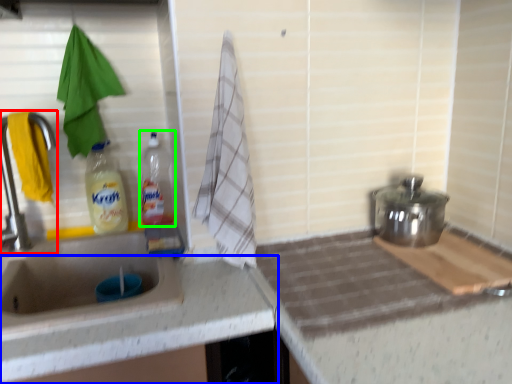
Question: Which is nearer to the tap (highlighted by a red box)? countertop (highlighted by a blue box) or bottle (highlighted by a green box).

Choices:
 (A) countertop
 (B) bottle

Answer: (B)